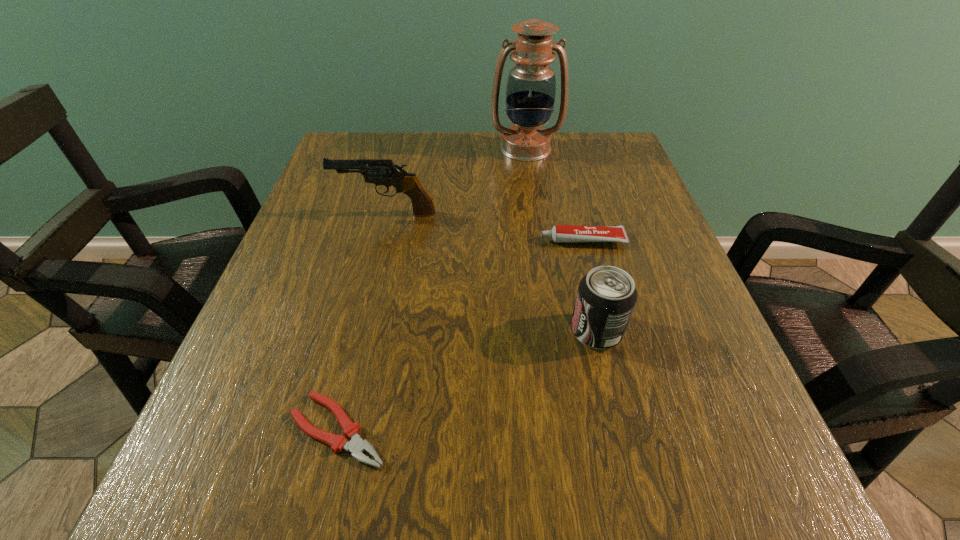
Identify the location of the tallest object. (531, 85).

Locate an element on the screen. This screenshot has width=960, height=540. the farthest object is located at coordinates (531, 85).

Locate an element on the screen. The image size is (960, 540). gun is located at coordinates (384, 172).

Where is `the fourth farthest object`? the fourth farthest object is located at coordinates (606, 296).

Where is `the third shortest object`? This screenshot has width=960, height=540. the third shortest object is located at coordinates (606, 296).

Where is `toothpaste`? Image resolution: width=960 pixels, height=540 pixels. toothpaste is located at coordinates (560, 233).

Identify the location of the third nearest object. (560, 233).

Identify the location of the shortest object. (356, 446).

Identify the location of pliers. (356, 446).

Locate an element on the screen. This screenshot has width=960, height=540. blank space located on the left of the tallest object is located at coordinates (387, 148).